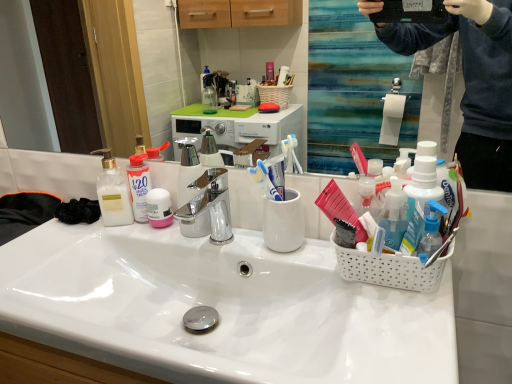
What is the approximate height of white glossy sink at center?

It is 4.34 inches.

You are a GUI agent. You are given a task and a screenshot of the screen. Output one action in this format:
    pyautogui.click(x=<x>, y=<y>)
    Task: Click on the white glossy sink at center
    
    Given the screenshot: What is the action you would take?
    pyautogui.click(x=220, y=308)

Describe the element at coordinates (220, 308) in the screenshot. I see `white glossy sink at center` at that location.

Measure the distance between point (376, 368) and camera.

A distance of 20.79 inches exists between point (376, 368) and camera.

Identify the location of white glossy sink at center. (220, 308).